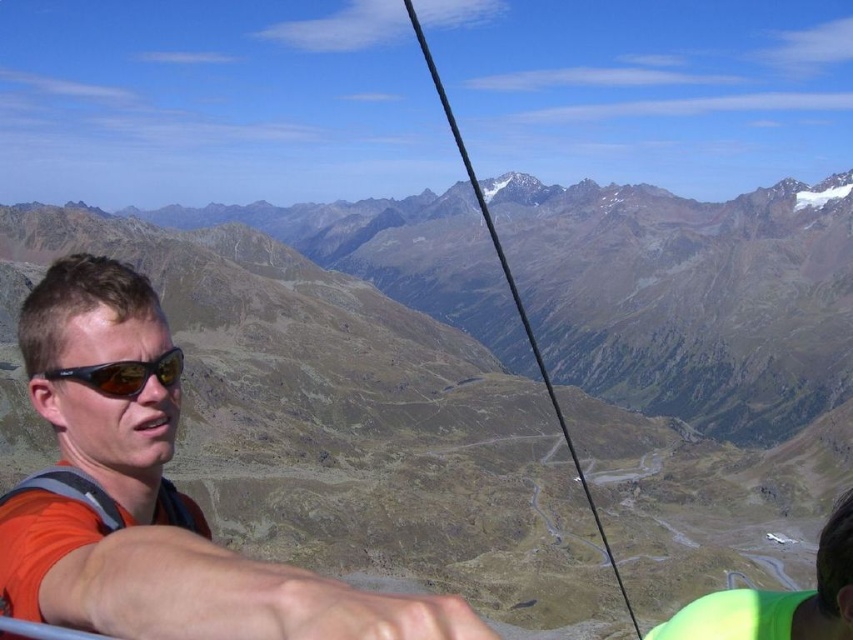
Who is more distant from viewer, (224, 348) or (138, 380)?

Positioned behind is point (224, 348).

Is brown rocky mountain at center shorter than matte black goggles at left?

In fact, brown rocky mountain at center may be taller than matte black goggles at left.

Is point (219, 476) in front of point (161, 376)?

No, it is behind (161, 376).

Locate an element on the screen. brown rocky mountain at center is located at coordinates (345, 396).

Can you confirm if orange fabric shirt at center is bigger than matte black goggles at left?

Yes, orange fabric shirt at center is bigger than matte black goggles at left.

Who is more distant from viewer, (64, 404) or (100, 372)?

The point (64, 404) is more distant.

At what (x,y) coordinates should I click in order to perform the action: click on orange fabric shirt at center. Please return your answer as a coordinate pair (x, y). This screenshot has width=853, height=640. Looking at the image, I should click on (154, 500).

Does brown rocky mountain at center have a smaller size compared to orange fabric shirt at center?

No.

Between point (589, 310) and point (173, 608), which one is positioned in front?

Positioned in front is point (173, 608).

Find the location of a particular element. This screenshot has height=640, width=853. brown rocky mountain at center is located at coordinates (345, 396).